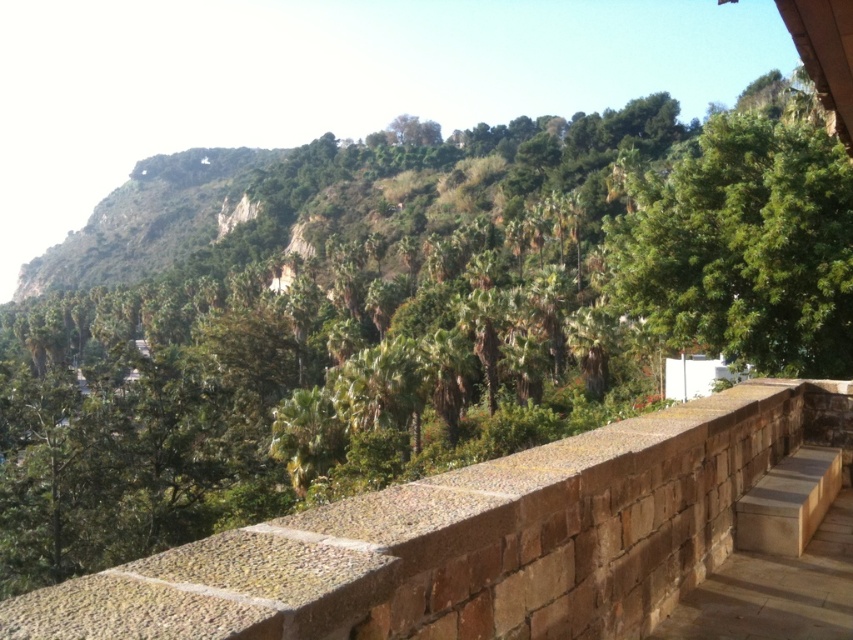
Question: Is brown stone ledge at center wider than green leafy tree at center?

Choices:
 (A) yes
 (B) no

Answer: (B)

Question: Can you confirm if brown stone ledge at center is positioned to the right of green leafy tree at center?

Choices:
 (A) yes
 (B) no

Answer: (B)

Question: Among these objects, which one is nearest to the camera?

Choices:
 (A) green leafy tree at center
 (B) brown stone ledge at center

Answer: (B)

Question: In this image, where is brown stone ledge at center located relative to green leafy tree at center?

Choices:
 (A) left
 (B) right

Answer: (A)

Question: Which of the following is the closest to the observer?

Choices:
 (A) (709, 292)
 (B) (207, 538)

Answer: (B)